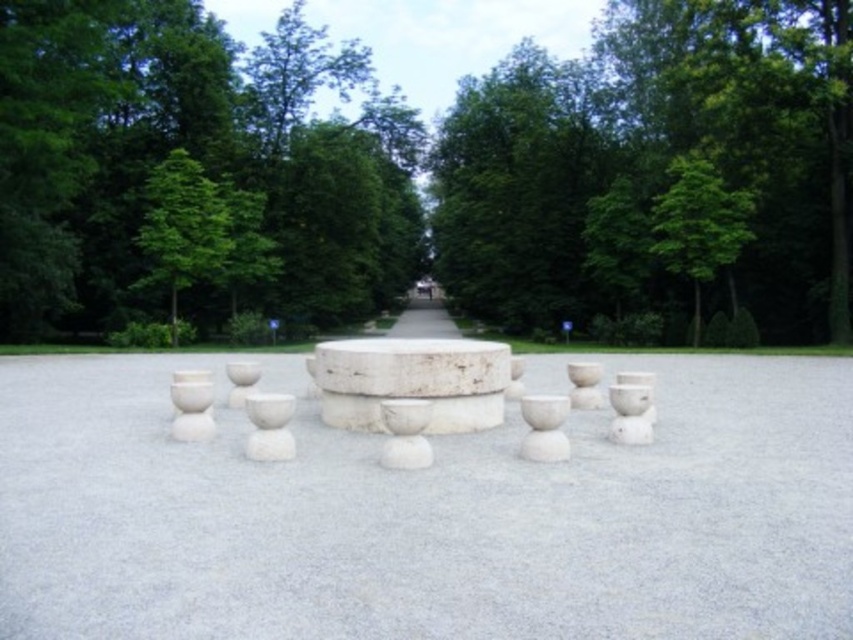
Between green leafy tree at upper center and green leafy tree at upper left, which one is positioned lower?

Positioned lower is green leafy tree at upper left.

Is green leafy tree at upper center further to camera compared to green leafy tree at upper left?

No, green leafy tree at upper center is in front of green leafy tree at upper left.

Find the location of a particular element. green leafy tree at upper center is located at coordinates (196, 170).

I want to click on green leafy tree at upper center, so click(196, 170).

Is the position of green leafy tree at center more distant than that of white stone table at center?

That is True.

This screenshot has width=853, height=640. In order to click on green leafy tree at center in this screenshot , I will do `click(432, 172)`.

Who is more forward, (479,104) or (599,582)?

Positioned in front is point (599,582).

Find the location of a particular element. green leafy tree at center is located at coordinates (432, 172).

Between point (148, 45) and point (216, 252), which one is positioned in front?

Point (216, 252) is in front.

Between green leafy tree at center and green leafy tree at upper left, which one has more height?

With more height is green leafy tree at center.

Does point (776, 76) come farther from viewer compared to point (177, 186)?

That is False.

You are a GUI agent. You are given a task and a screenshot of the screen. Output one action in this format:
    pyautogui.click(x=<x>, y=<y>)
    Task: Click on the green leafy tree at center
    The height and width of the screenshot is (640, 853).
    Given the screenshot: What is the action you would take?
    pyautogui.click(x=432, y=172)